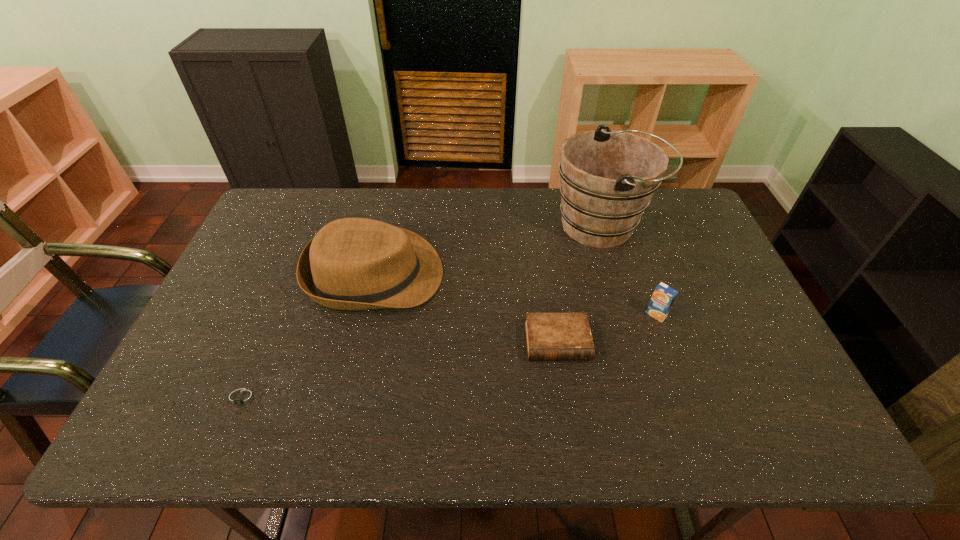
You are a GUI agent. You are given a task and a screenshot of the screen. Output one action in this format:
    pyautogui.click(x=<x>, y=<y>)
    Task: Click on the vacant region at the left edge
    This screenshot has height=540, width=960.
    Given the screenshot: What is the action you would take?
    pyautogui.click(x=189, y=393)

Where is `free space at the right edge`? The height and width of the screenshot is (540, 960). free space at the right edge is located at coordinates (742, 388).

At what (x,y) coordinates should I click in order to perform the action: click on free space at the far left corner of the desktop. Please return your answer as a coordinate pair (x, y). Looking at the image, I should click on (303, 214).

Image resolution: width=960 pixels, height=540 pixels. I want to click on blank space at the far right corner of the desktop, so click(653, 200).

Find the location of a particular element. The image size is (960, 540). vacant position at the near right corner of the desktop is located at coordinates (806, 443).

You are a GUI agent. You are given a task and a screenshot of the screen. Output one action in this format:
    pyautogui.click(x=<x>, y=<y>)
    Task: Click on the free space between the fedora and the tallest object
    The image size is (960, 540).
    Given the screenshot: What is the action you would take?
    pyautogui.click(x=489, y=250)

Image resolution: width=960 pixels, height=540 pixels. I want to click on vacant space that's between the tallest object and the second tallest object, so click(x=489, y=250).

Where is `empty space that is in between the fedora and the orange_juice`? The image size is (960, 540). empty space that is in between the fedora and the orange_juice is located at coordinates (516, 294).

Locate an element on the screen. This screenshot has width=960, height=540. empty space between the third shortest object and the second tallest object is located at coordinates (516, 294).

At what (x,y) coordinates should I click in order to perform the action: click on unoccupied area between the fedora and the fourth farthest object. Please return your answer as a coordinate pair (x, y). Looking at the image, I should click on (466, 308).